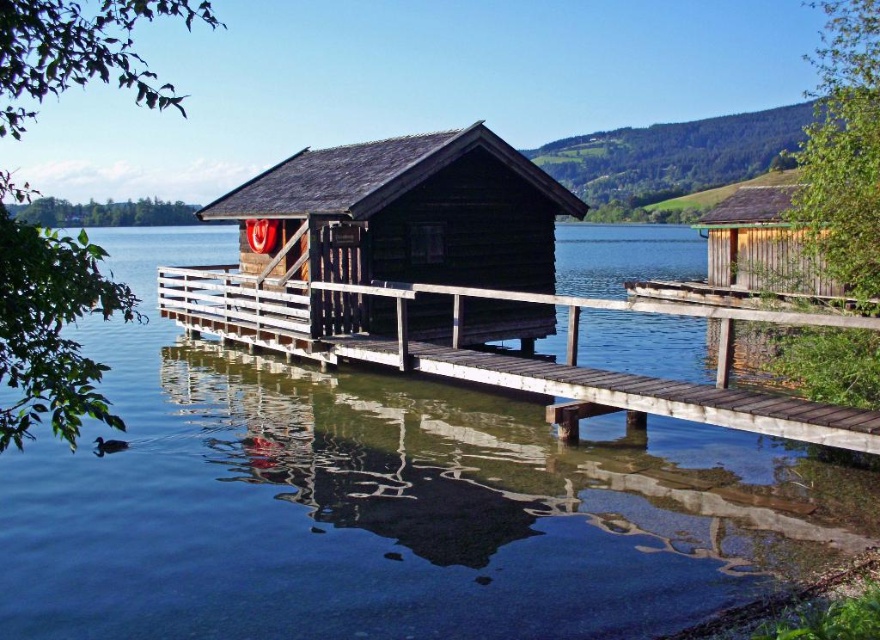
Question: Which is farther from the transparent water at dock center?

Choices:
 (A) wooden cabin at right
 (B) dark brown wooden cabin at center
 (C) wooden dock at center

Answer: (A)

Question: Does dark brown wooden cabin at center have a lesser width compared to wooden dock at center?

Choices:
 (A) no
 (B) yes

Answer: (B)

Question: Which point is farther from the camera taking this photo?

Choices:
 (A) (785, 413)
 (B) (625, 612)

Answer: (A)

Question: Which point appears farthest from the camera in this image?

Choices:
 (A) (274, 326)
 (B) (372, 211)
 (C) (782, 216)

Answer: (C)

Question: Is wooden dock at center below wooden cabin at right?

Choices:
 (A) yes
 (B) no

Answer: (A)

Question: In this image, where is dark brown wooden cabin at center located relative to wooden dock at center?

Choices:
 (A) below
 (B) above

Answer: (B)